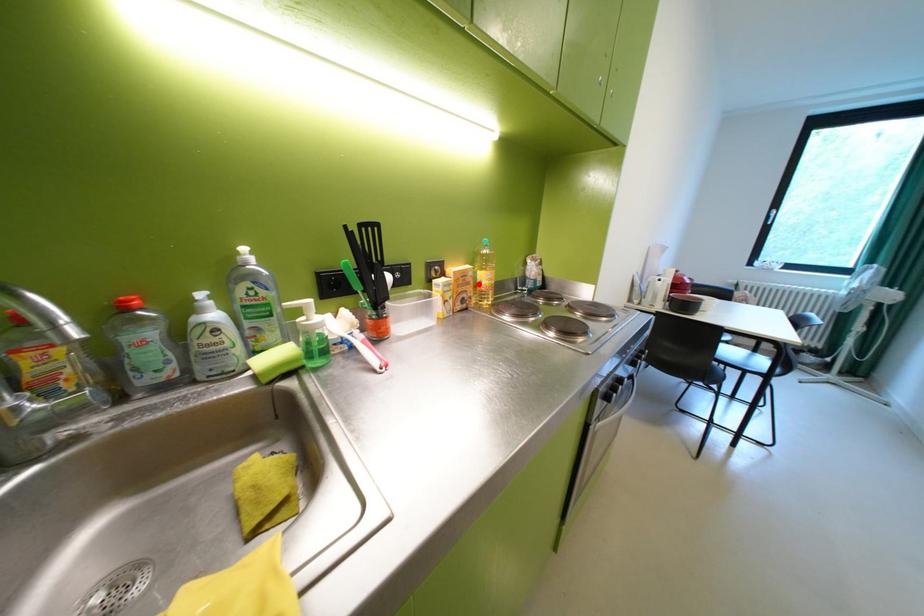
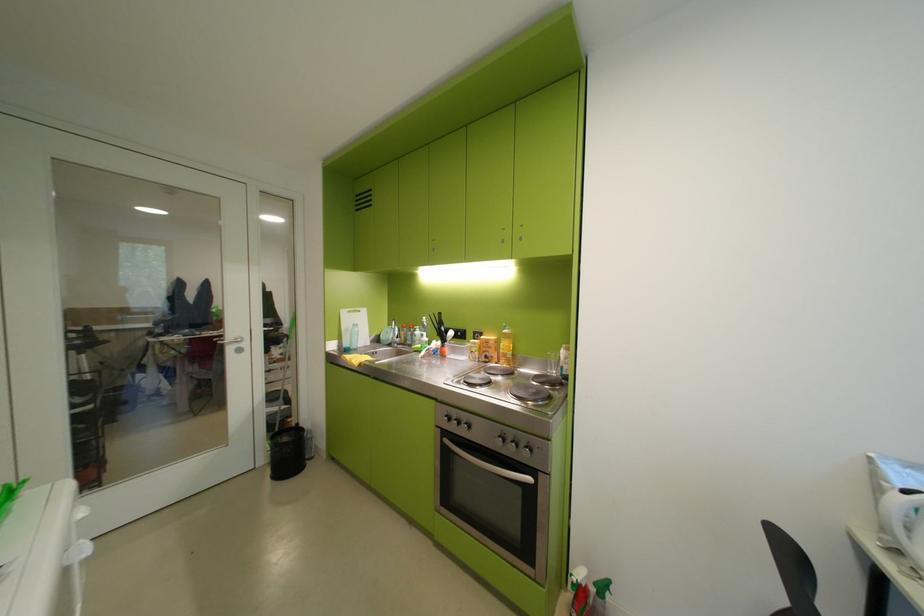
Question: I am providing you with two images of the same scene from different viewpoints. A red point is marked on the first image. Is the red point's position out of view in image 2?

Choices:
 (A) Yes
 (B) No

Answer: (B)